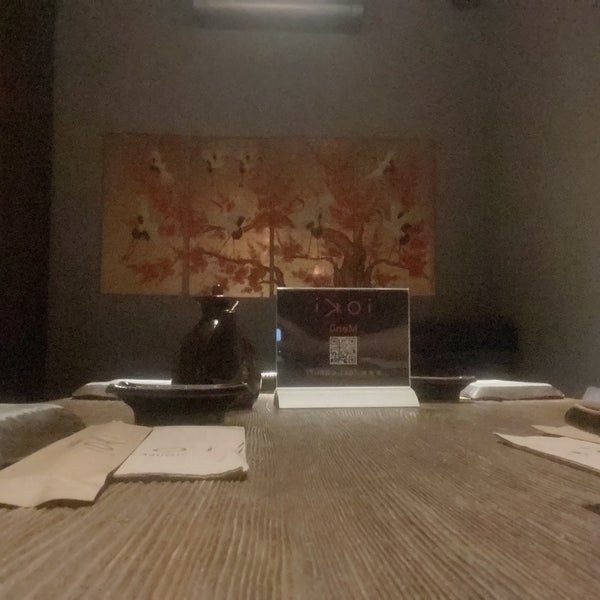
Locate an element on the screen. This screenshot has width=600, height=600. empty wall to the right of frame is located at coordinates (457, 217).